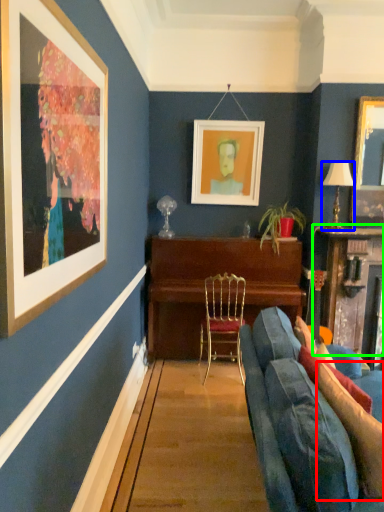
Question: Which object is the closest to the pillow (highlighted by a red box)? Choose among these: lamp (highlighted by a blue box) or table (highlighted by a green box).

Choices:
 (A) lamp
 (B) table

Answer: (B)